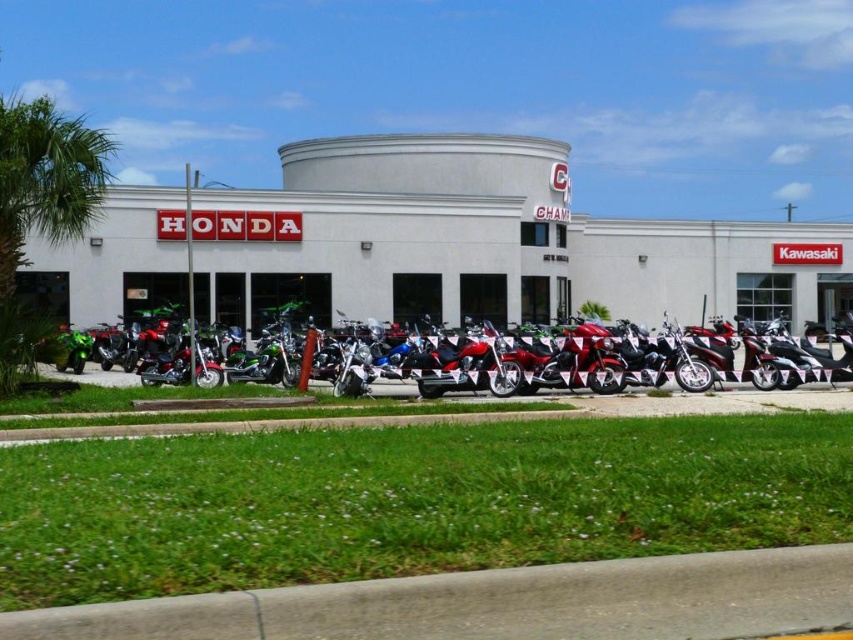
Is green leafy palm tree at left above green matte motorcycle at center?

Indeed, green leafy palm tree at left is positioned over green matte motorcycle at center.

Which is behind, point (59, 166) or point (740, 358)?

Point (740, 358)

Measure the distance between point (x=0, y=163) and camera.

Point (x=0, y=163) is 16.42 meters from camera.

Identify the location of green leafy palm tree at left. (39, 205).

Between shiny chrome motorcycle at center and green matte motorcycle at center, which one has less height?

With less height is shiny chrome motorcycle at center.

Is point (479, 376) less distant than point (79, 376)?

Yes, point (479, 376) is in front of point (79, 376).

The height and width of the screenshot is (640, 853). Find the location of `shiny chrome motorcycle at center`. shiny chrome motorcycle at center is located at coordinates (468, 365).

Who is shorter, green leafy palm tree at left or shiny chrome motorcycle at center?

With less height is shiny chrome motorcycle at center.

Which is below, green leafy palm tree at left or shiny chrome motorcycle at center?

shiny chrome motorcycle at center is lower down.

Which is behind, point (84, 177) or point (494, 392)?

The point (494, 392) is behind.

I want to click on green leafy palm tree at left, so click(39, 205).